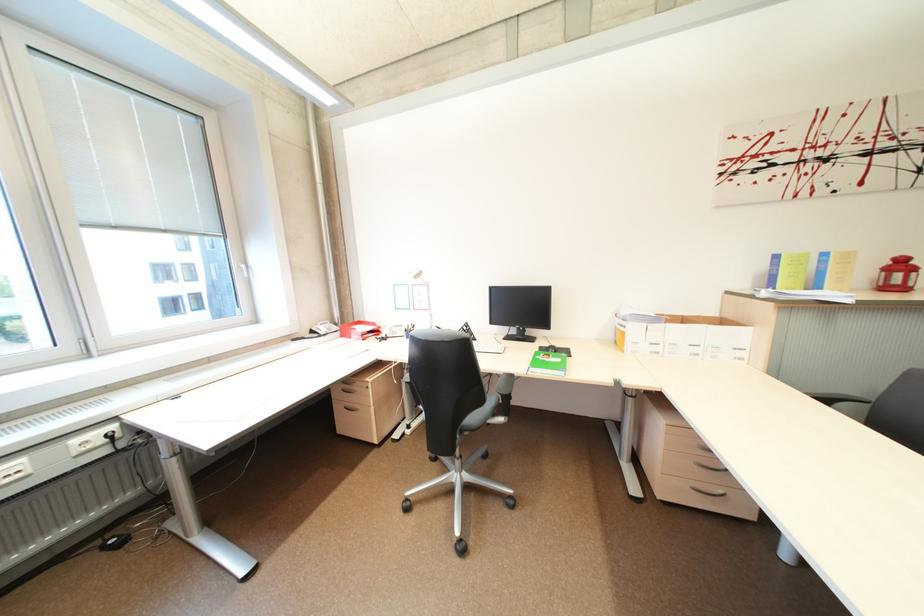
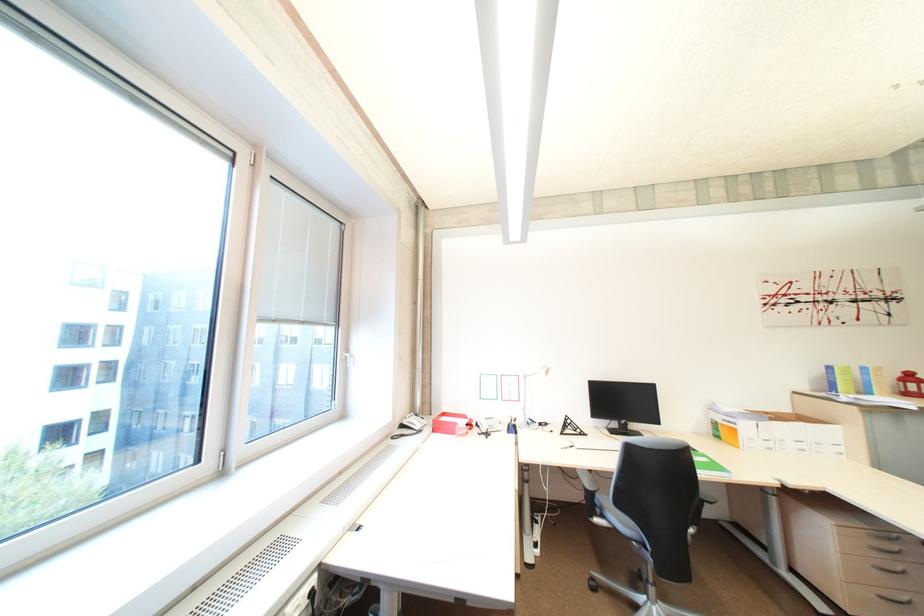
Locate, in the second image, the point that corresponds to [321,333] in the first image.

(410, 427)